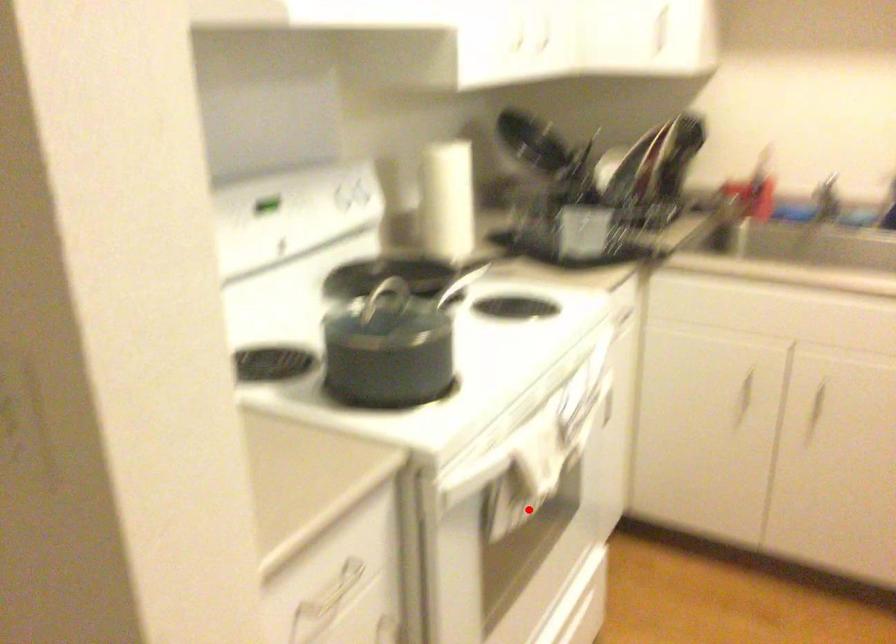
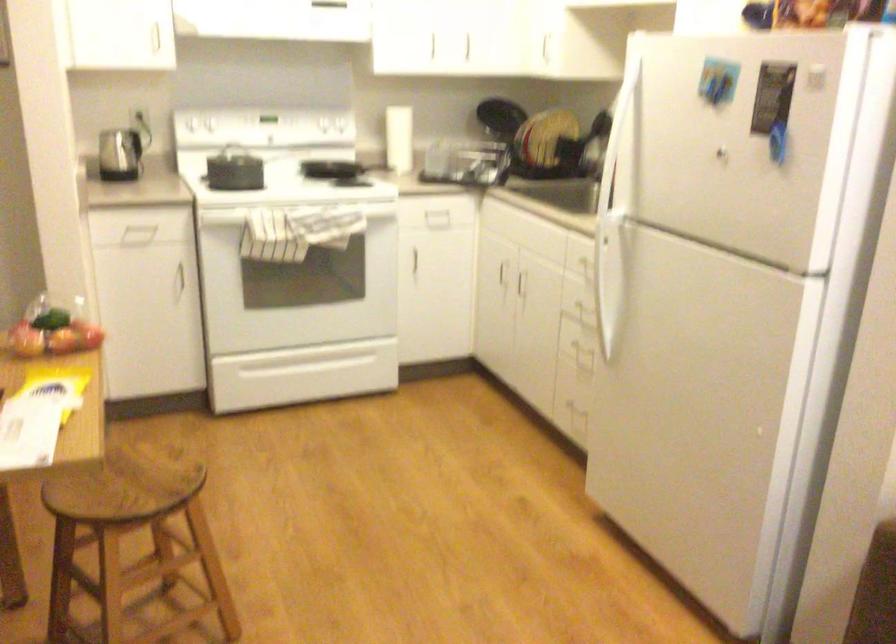
Locate, in the second image, the point that corresponds to the highlighted location in the first image.

(289, 261)